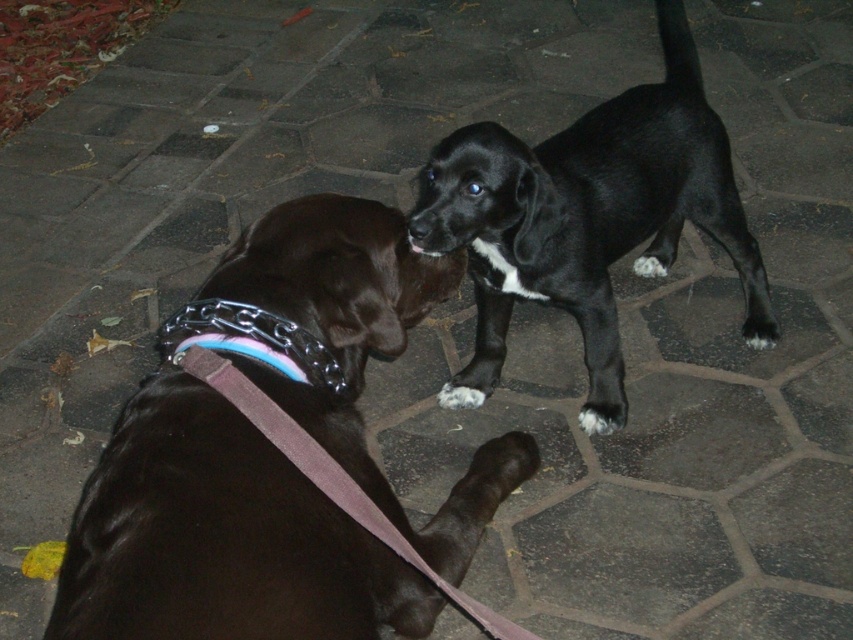
Does point (474, 392) come closer to viewer compared to point (302, 429)?

No, it is behind (302, 429).

Who is higher up, black glossy fur at upper right or purple fabric leash at lower center?

black glossy fur at upper right

Does point (608, 164) come behind point (534, 637)?

Yes, it is.

Where is `black glossy fur at upper right`? black glossy fur at upper right is located at coordinates (587, 218).

Is shiny black dog at center thinner than black glossy fur at upper right?

Answer: Yes.

Who is higher up, shiny black dog at center or black glossy fur at upper right?

Positioned higher is black glossy fur at upper right.

Between point (396, 227) and point (606, 180), which one is positioned in front?

Point (396, 227) is more forward.

Identify the location of shiny black dog at center. (276, 454).

Does shiny black dog at center have a larger size compared to purple fabric leash at lower center?

Correct, shiny black dog at center is larger in size than purple fabric leash at lower center.

Is point (303, 317) positioned before point (318, 476)?

No.

Is point (267, 512) positioned after point (341, 486)?

No.

Identify the location of shiny black dog at center. (276, 454).